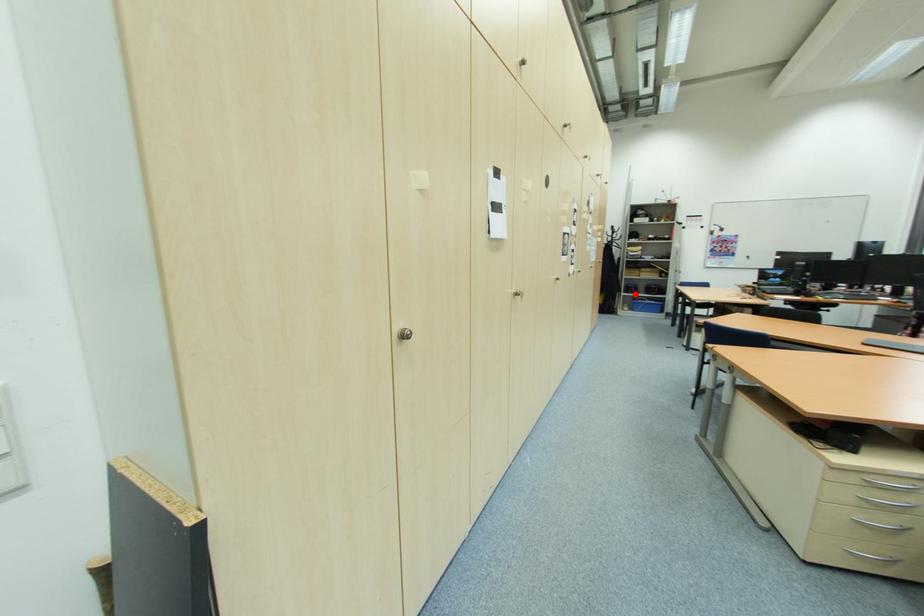
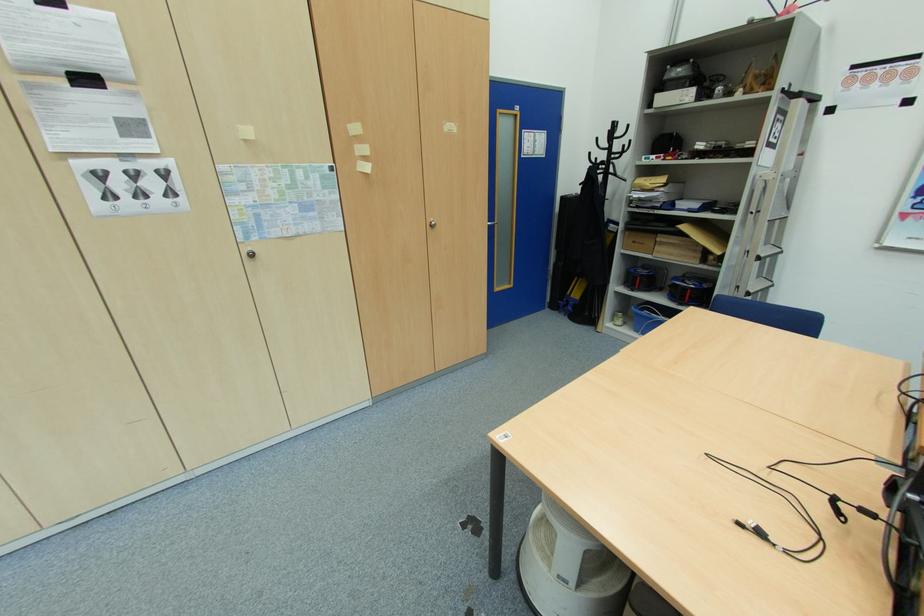
In the second image, find the point that corresponds to the highlighted location in the first image.

(637, 291)